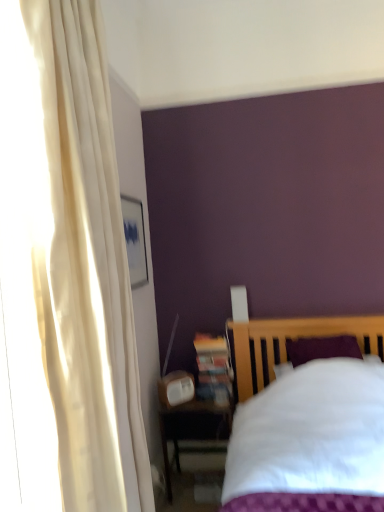
Question: Is wooden bookshelf at lower center thinner than white cotton bed at lower right?

Choices:
 (A) yes
 (B) no

Answer: (A)

Question: Is wooden bookshelf at lower center not within white cotton bed at lower right?

Choices:
 (A) no
 (B) yes

Answer: (B)

Question: Considering the relative sizes of wooden bookshelf at lower center and white cotton bed at lower right in the image provided, is wooden bookshelf at lower center taller than white cotton bed at lower right?

Choices:
 (A) yes
 (B) no

Answer: (B)

Question: Does wooden bookshelf at lower center lie behind white cotton bed at lower right?

Choices:
 (A) yes
 (B) no

Answer: (A)

Question: From a real-world perspective, is wooden bookshelf at lower center beneath white cotton bed at lower right?

Choices:
 (A) no
 (B) yes

Answer: (A)

Question: Looking at the image, does matte wooden nightstand at lower left seem bigger or smaller compared to white cotton bed at lower right?

Choices:
 (A) big
 (B) small

Answer: (B)

Question: In terms of width, does matte wooden nightstand at lower left look wider or thinner when compared to white cotton bed at lower right?

Choices:
 (A) wide
 (B) thin

Answer: (B)

Question: In terms of height, does matte wooden nightstand at lower left look taller or shorter compared to white cotton bed at lower right?

Choices:
 (A) tall
 (B) short

Answer: (B)

Question: From the image's perspective, is matte wooden nightstand at lower left above or below white cotton bed at lower right?

Choices:
 (A) above
 (B) below

Answer: (B)

Question: Considering the positions of white cotton bed at lower right and wooden bookshelf at lower center in the image, is white cotton bed at lower right bigger or smaller than wooden bookshelf at lower center?

Choices:
 (A) small
 (B) big

Answer: (B)

Question: From a real-world perspective, is white cotton bed at lower right physically located above or below wooden bookshelf at lower center?

Choices:
 (A) above
 (B) below

Answer: (B)

Question: Is white cotton bed at lower right inside the boundaries of wooden bookshelf at lower center, or outside?

Choices:
 (A) outside
 (B) inside

Answer: (A)

Question: Is white cotton bed at lower right to the left or to the right of wooden bookshelf at lower center in the image?

Choices:
 (A) right
 (B) left

Answer: (A)

Question: Based on their sizes in the image, would you say wooden bookshelf at lower center is bigger or smaller than white cotton bed at lower right?

Choices:
 (A) small
 (B) big

Answer: (A)

Question: From a real-world perspective, relative to white cotton bed at lower right, is wooden bookshelf at lower center vertically above or below?

Choices:
 (A) above
 (B) below

Answer: (A)